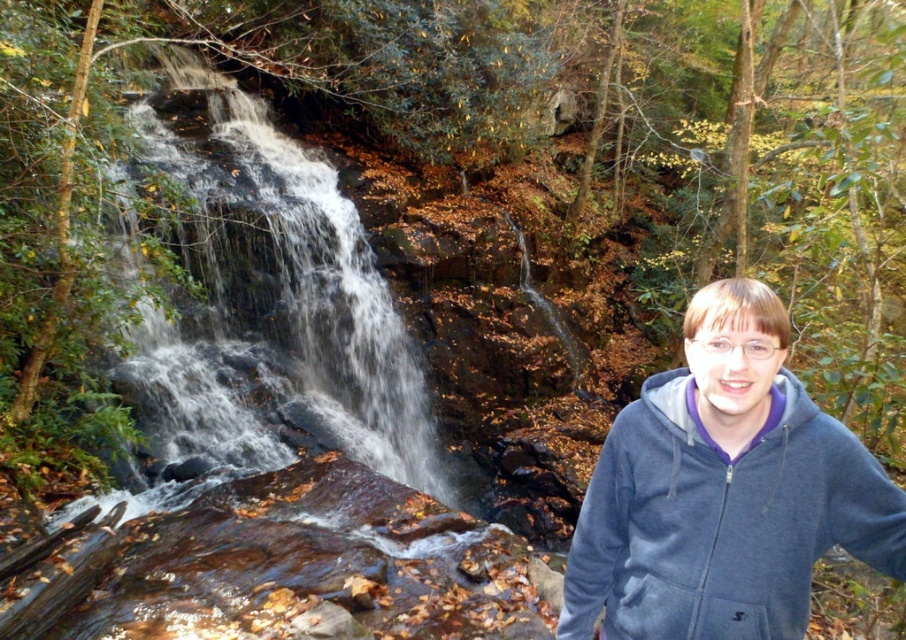
Consider the image. You are a photographer positioned at the dark blue fleece sweatshirt at right and want to capture a closeup shot of the white frothy water at left. Given that your camera has a maximum zoom range of 10 meters, will you be able to take the photo without moving closer?

The distance between the white frothy water at left and dark blue fleece sweatshirt at right is 7.54 meters. Since your camera can zoom up to 10 meters, you can capture the closeup shot without moving closer.

You are a photographer trying to capture a photo of the white frothy water at left and the dark blue fleece sweatshirt at right. Which object is closer to the camera based on their positions?

The dark blue fleece sweatshirt at right is closer to the camera because the white frothy water at left is positioned under it, indicating it is behind.

Looking at this image, you are a photographer positioned at the center of the scene. You want to take a photo of both the white frothy water at left and the dark blue fleece sweatshirt at right. Which object should you focus on first to ensure it appears sharp in the photo?

You should focus on the white frothy water at left first because it is closer to you than the dark blue fleece sweatshirt at right, so it requires proper focus to capture its details clearly before adjusting for the background.